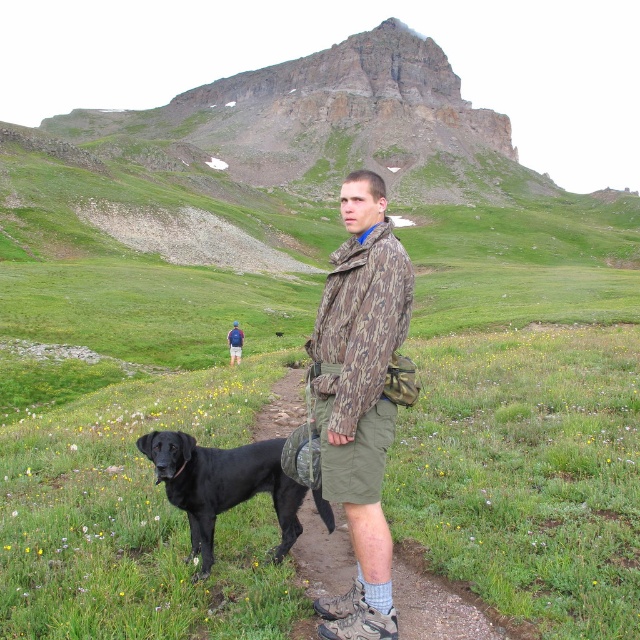
Who is lower down, black matte dog at lower left or camouflage jacket at center?

black matte dog at lower left

Who is positioned more to the right, black matte dog at lower left or camouflage jacket at center?

Positioned to the right is black matte dog at lower left.

Identify the location of black matte dog at lower left. (221, 484).

Where is `black matte dog at lower left`? The image size is (640, 640). black matte dog at lower left is located at coordinates (221, 484).

Does camouflagematerial/texture at center come behind camouflage jacket at center?

That is False.

Can you confirm if camouflagematerial/texture at center is taller than camouflage jacket at center?

Indeed, camouflagematerial/texture at center has a greater height compared to camouflage jacket at center.

Is point (316, 342) positioned after point (227, 342)?

No, (316, 342) is in front of (227, 342).

Identify the location of camouflagematerial/texture at center. This screenshot has height=640, width=640. (360, 323).

Who is positioned more to the left, camo jacket at center or black matte dog at lower left?

black matte dog at lower left is more to the left.

Which is below, camo jacket at center or black matte dog at lower left?

black matte dog at lower left is below.

This screenshot has width=640, height=640. I want to click on camo jacket at center, so click(x=358, y=397).

Identify the location of camo jacket at center. This screenshot has height=640, width=640. (358, 397).